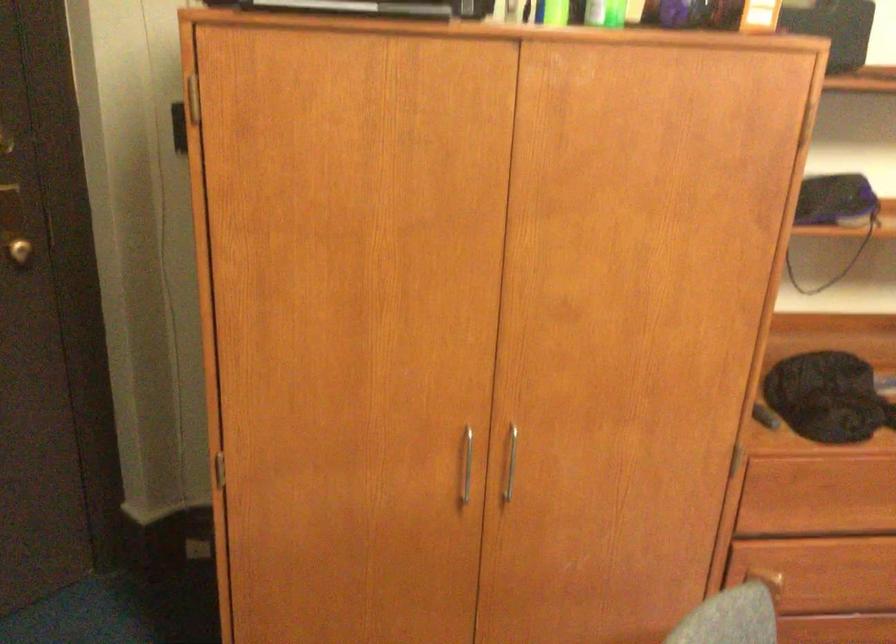
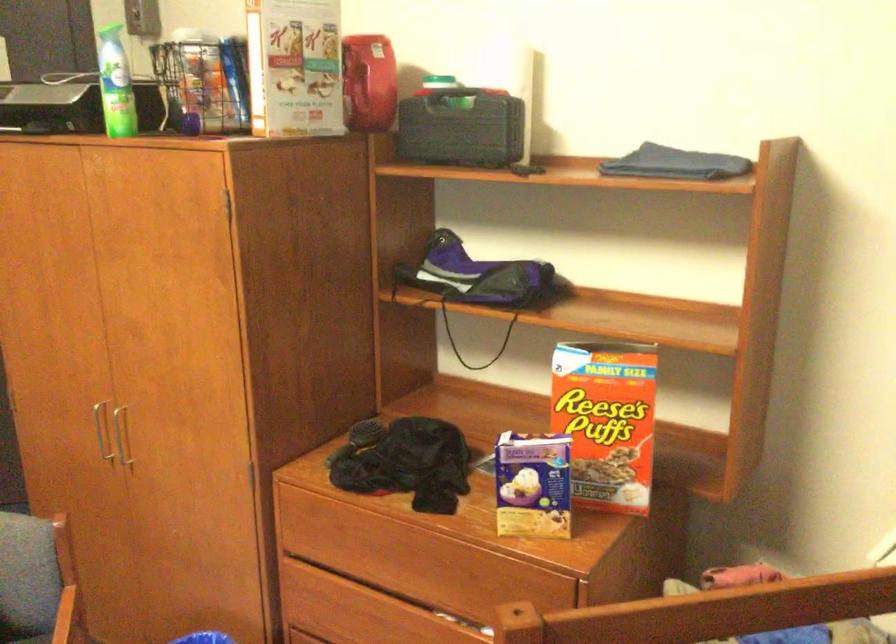
In the second image, find the point that corresponds to pixel 497 456 in the first image.

(119, 436)